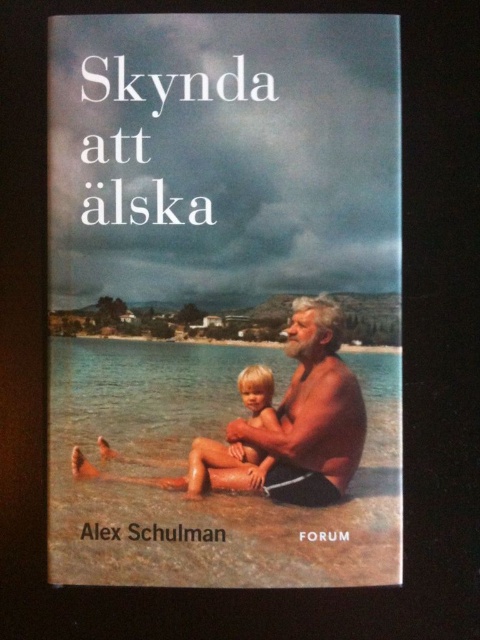
Is matte black book cover at center to the right of smooth skin man at center from the viewer's perspective?

Incorrect, matte black book cover at center is not on the right side of smooth skin man at center.

Can you confirm if matte black book cover at center is shorter than smooth skin man at center?

No.

Does point (236, 412) come closer to viewer compared to point (123, 477)?

No, (236, 412) is behind (123, 477).

Locate an element on the screen. The image size is (480, 640). matte black book cover at center is located at coordinates (224, 296).

Is matte black book cover at center wider than blonde hair skin at center?

Yes, matte black book cover at center is wider than blonde hair skin at center.

Can you confirm if matte black book cover at center is thinner than blonde hair skin at center?

In fact, matte black book cover at center might be wider than blonde hair skin at center.

What do you see at coordinates (224, 296) in the screenshot? I see `matte black book cover at center` at bounding box center [224, 296].

Locate an element on the screen. This screenshot has width=480, height=640. matte black book cover at center is located at coordinates (224, 296).

Does smooth skin man at center appear under blonde hair skin at center?

No.

Who is more distant from viewer, (263, 476) or (200, 468)?

Positioned behind is point (200, 468).

The height and width of the screenshot is (640, 480). I want to click on smooth skin man at center, so click(288, 422).